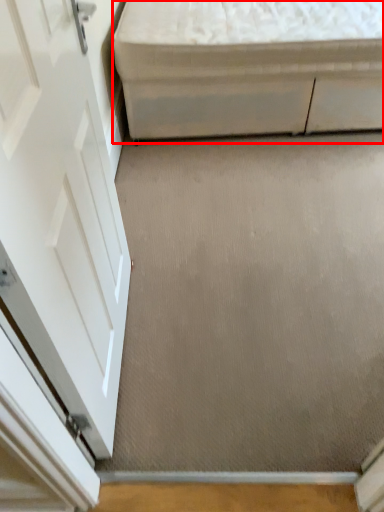
Question: Where is furniture (annotated by the red box) located in relation to concrete in the image?

Choices:
 (A) left
 (B) right

Answer: (B)